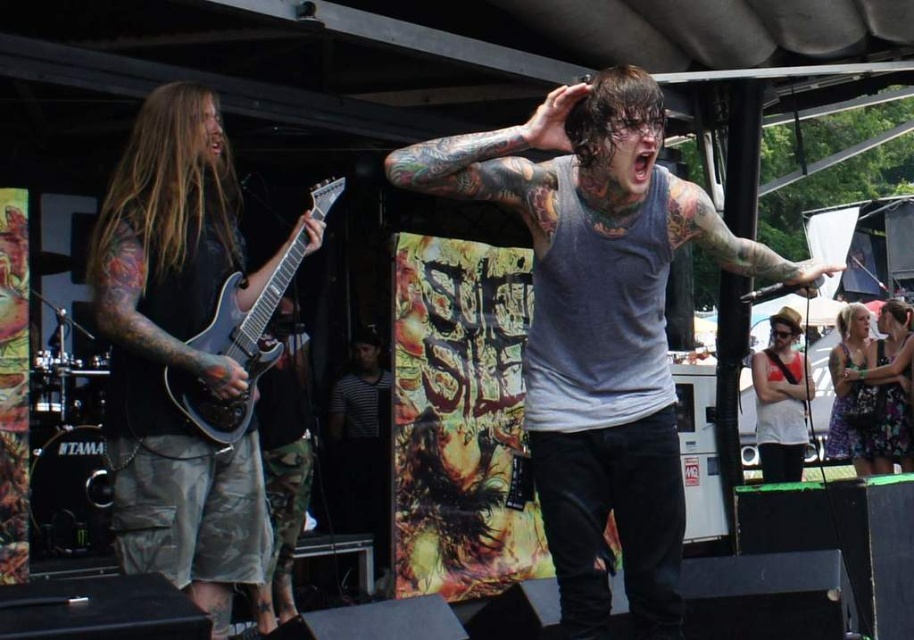
You are a photographer at the concert and want to capture the metallic silver electric guitar at left. Where should you position your camera to get the best shot?

To capture the metallic silver electric guitar at left, position your camera near the point coordinates of 0.547 on the x axis and 0.259 on the y axis.

You are a photographer at the concert and want to capture a closeup of the matte black guitar at left and metallic silver electric guitar at left. Which guitar should you focus on to ensure it appears larger in your photo?

The matte black guitar at left is closer to the viewer than the metallic silver electric guitar at left, so focusing on it will make it appear larger in the photo.